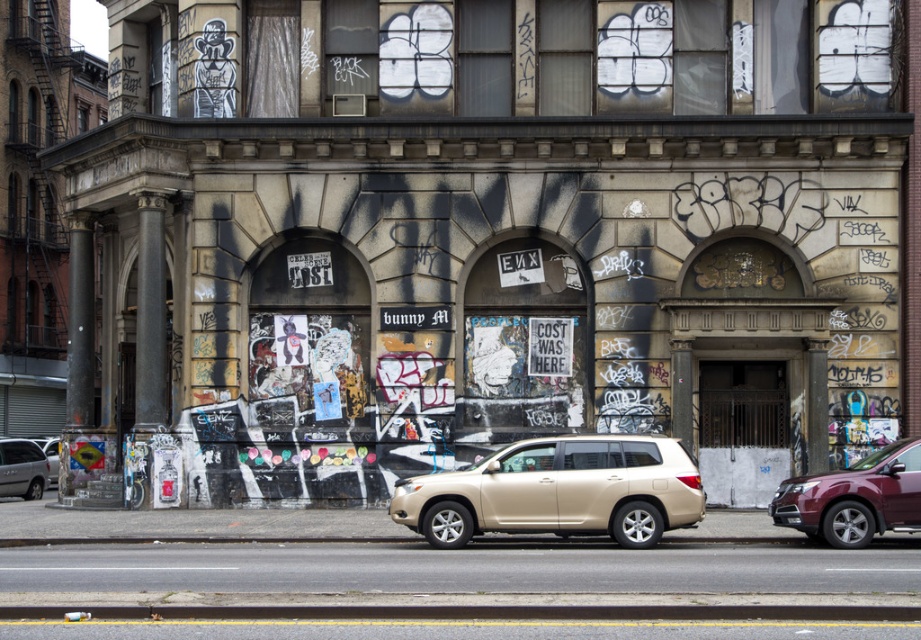
Can you confirm if gold matte suv at center is wider than maroon metallic suv at right?

Indeed, gold matte suv at center has a greater width compared to maroon metallic suv at right.

Which is more to the right, gold matte suv at center or maroon metallic suv at right?

maroon metallic suv at right

Image resolution: width=921 pixels, height=640 pixels. What do you see at coordinates (558, 492) in the screenshot?
I see `gold matte suv at center` at bounding box center [558, 492].

The width and height of the screenshot is (921, 640). I want to click on gold matte suv at center, so click(558, 492).

Does maroon metallic suv at right appear on the left side of gold metallic suv at center?

No, maroon metallic suv at right is not to the left of gold metallic suv at center.

What do you see at coordinates (854, 497) in the screenshot?
I see `maroon metallic suv at right` at bounding box center [854, 497].

Image resolution: width=921 pixels, height=640 pixels. In order to click on maroon metallic suv at right in this screenshot , I will do `click(854, 497)`.

Does gold matte suv at center have a greater height compared to gold metallic suv at center?

No, gold matte suv at center is not taller than gold metallic suv at center.

Who is more forward, (539,476) or (44,476)?

Point (539,476)

What do you see at coordinates (558, 492) in the screenshot?
I see `gold matte suv at center` at bounding box center [558, 492].

Locate an element on the screen. This screenshot has width=921, height=640. gold matte suv at center is located at coordinates (558, 492).